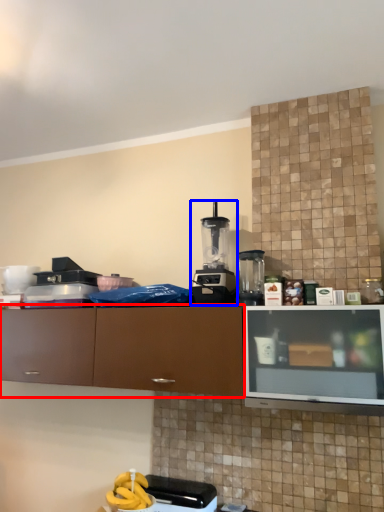
Question: Among these objects, which one is farthest to the camera, cabinetry (highlighted by a red box) or kitchen appliance (highlighted by a blue box)?

Choices:
 (A) cabinetry
 (B) kitchen appliance

Answer: (B)